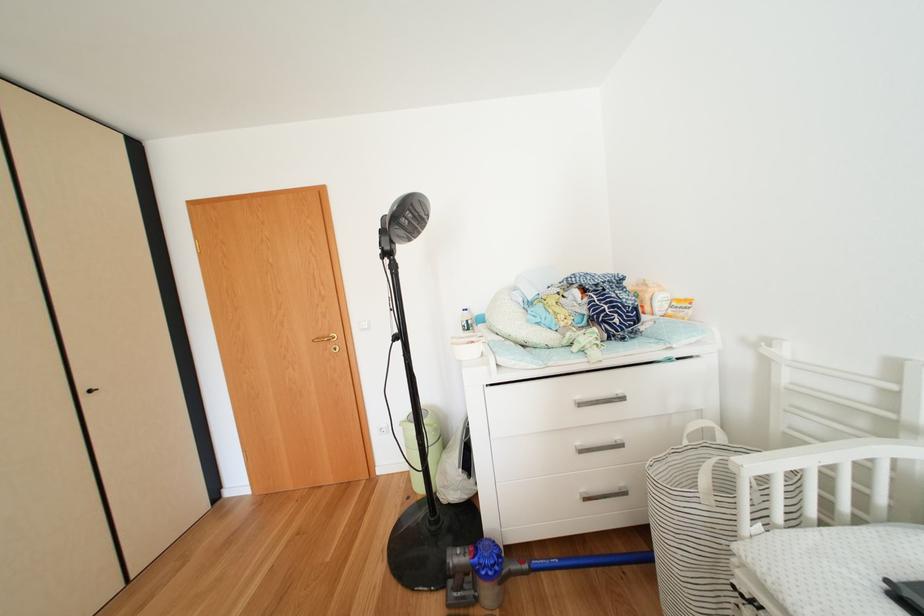
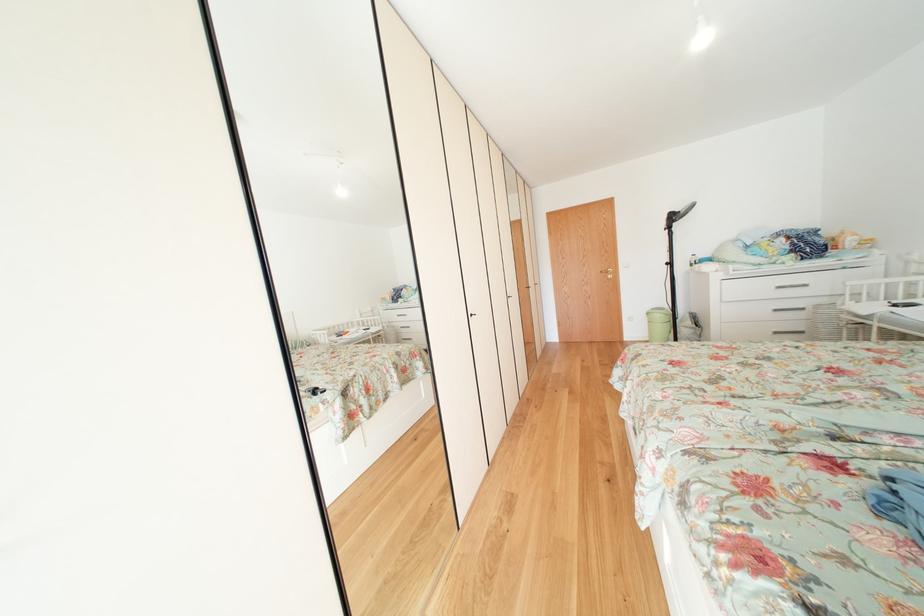
In the second image, find the point that corresponds to point (596, 505) in the first image.

(784, 338)